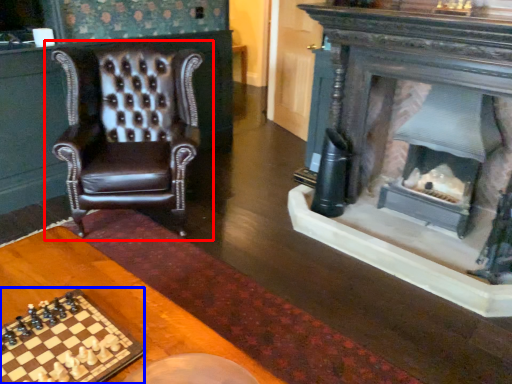
Question: Which of the following is the farthest to the observer, chair (highlighted by a red box) or board game (highlighted by a blue box)?

Choices:
 (A) chair
 (B) board game

Answer: (A)